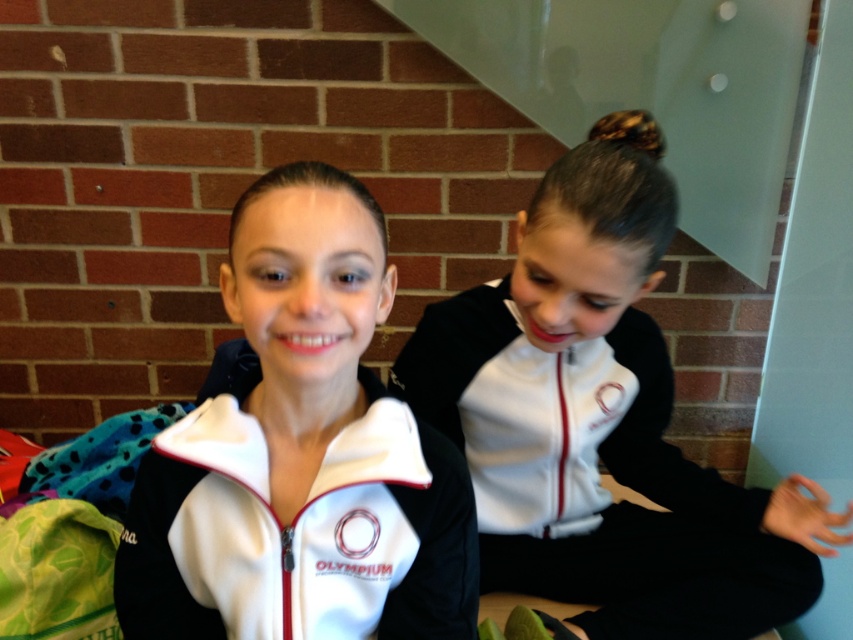
Can you confirm if white matte jacket at center is positioned to the left of white matte jacket at right?

Indeed, white matte jacket at center is positioned on the left side of white matte jacket at right.

Between point (306, 216) and point (772, 589), which one is positioned in front?

Point (306, 216)

Identify the location of white matte jacket at center. (300, 452).